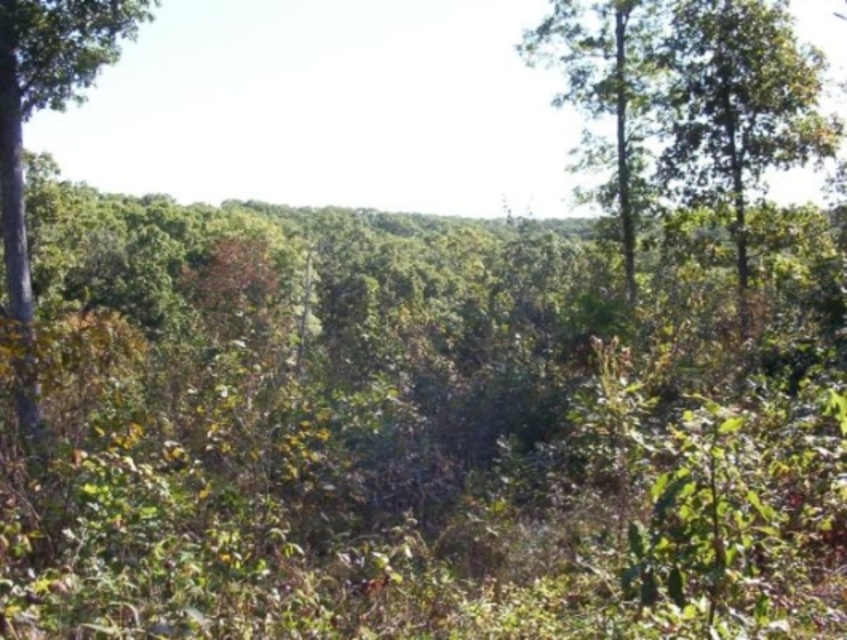
Question: Is green leafy tree at upper right to the right of green leafy tree at left from the viewer's perspective?

Choices:
 (A) yes
 (B) no

Answer: (A)

Question: Which point is farther to the camera?

Choices:
 (A) green leafy tree at left
 (B) green leafy tree at upper right

Answer: (B)

Question: Does green leafy tree at upper right lie in front of green leafy tree at left?

Choices:
 (A) no
 (B) yes

Answer: (A)

Question: Can you confirm if green leafy tree at upper right is positioned above green leafy tree at left?

Choices:
 (A) no
 (B) yes

Answer: (B)

Question: Which object is farther from the camera taking this photo?

Choices:
 (A) green leafy tree at upper right
 (B) green leafy tree at left

Answer: (A)